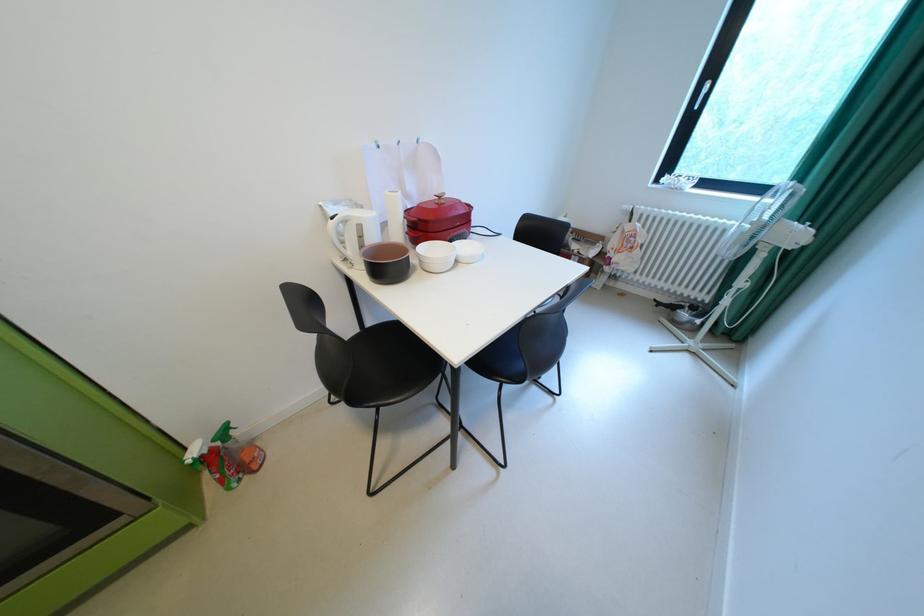
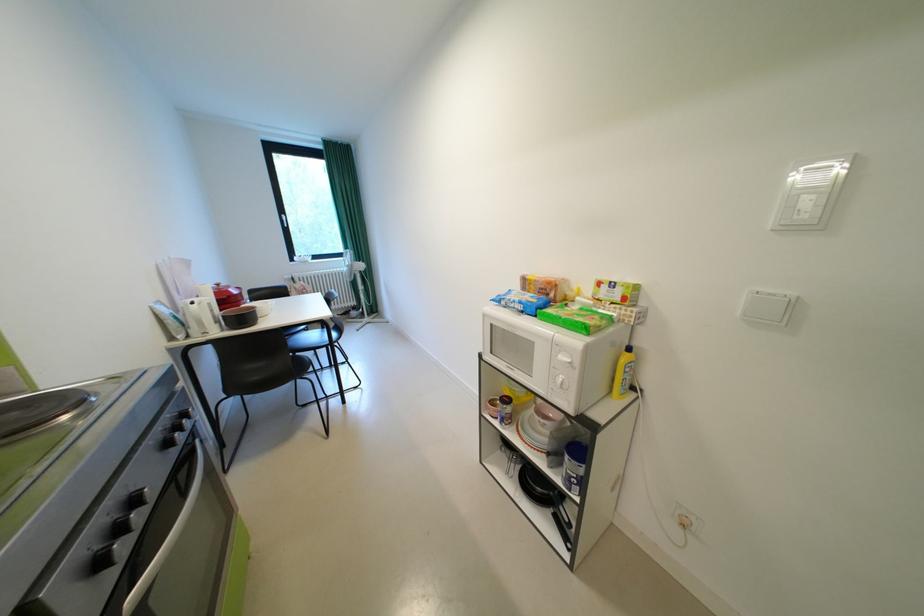
Locate, in the second image, the point that corresponds to [450,198] in the first image.

(228, 286)